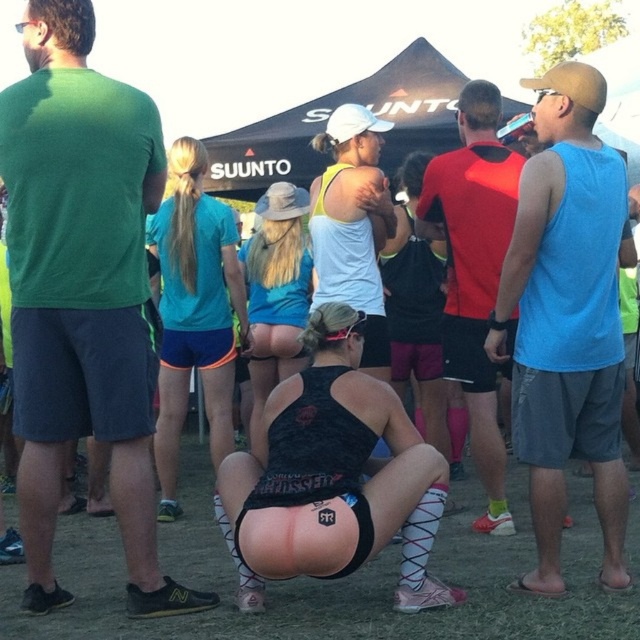
Question: Which point is farther to the camera?

Choices:
 (A) (520, 324)
 (B) (262, 285)

Answer: (B)

Question: Which point is closer to the camera?

Choices:
 (A) red shirt at center
 (B) black matte tank top at center
 (C) blue sleeveless tank top at right
 (D) matte blue tank top at center

Answer: (B)

Question: Estimate the real-world distances between objects in this image. Which object is closer to the teal fabric shorts at center?

Choices:
 (A) green fabric shirt at left
 (B) white matte tank top at center
 (C) black matte tank top at center

Answer: (B)

Question: Can you confirm if black matte tank top at center is positioned above red shirt at center?

Choices:
 (A) yes
 (B) no

Answer: (B)

Question: Considering the relative positions of red shirt at center and teal fabric shorts at center in the image provided, where is red shirt at center located with respect to teal fabric shorts at center?

Choices:
 (A) below
 (B) above

Answer: (B)

Question: Is red shirt at center to the right of matte black tank top at center from the viewer's perspective?

Choices:
 (A) yes
 (B) no

Answer: (A)